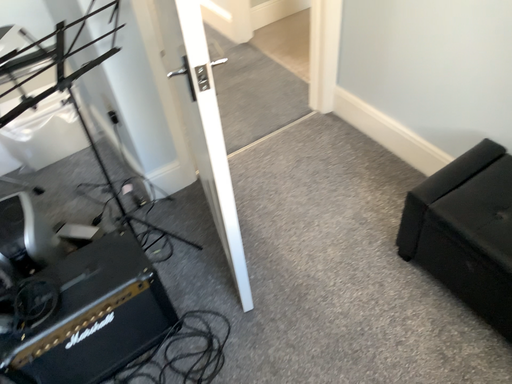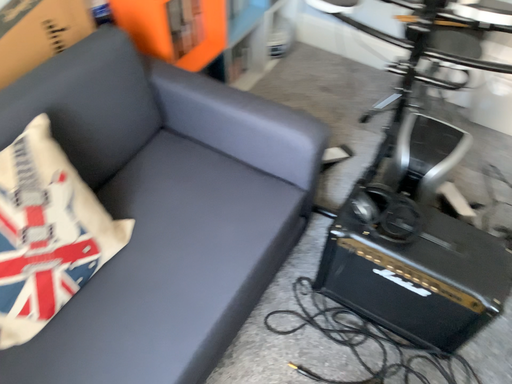
Question: How did the camera likely rotate when shooting the video?

Choices:
 (A) rotated left
 (B) rotated right

Answer: (A)